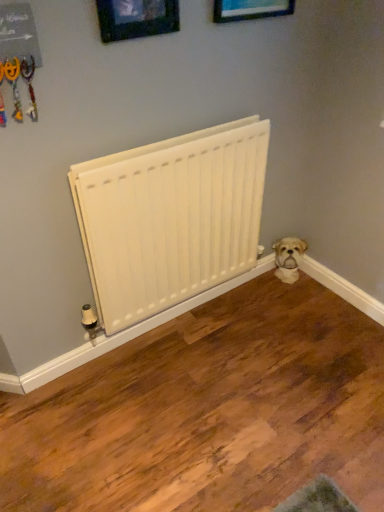
Question: Considering the relative sizes of white fluffy dog at lower right and wooden picture frame at upper center, which is the 1th picture frame from right to left, in the image provided, is white fluffy dog at lower right wider than wooden picture frame at upper center, which is the 1th picture frame from right to left,?

Choices:
 (A) yes
 (B) no

Answer: (A)

Question: Can you confirm if white fluffy dog at lower right is shorter than wooden picture frame at upper center, which is the 1th picture frame from right to left?

Choices:
 (A) no
 (B) yes

Answer: (B)

Question: Does white fluffy dog at lower right contain wooden picture frame at upper center, which is the 1th picture frame from right to left?

Choices:
 (A) no
 (B) yes

Answer: (A)

Question: Is white fluffy dog at lower right thinner than wooden picture frame at upper center, which is the 1th picture frame from right to left?

Choices:
 (A) yes
 (B) no

Answer: (B)

Question: Is white fluffy dog at lower right not close to wooden picture frame at upper center, arranged as the 2th picture frame when viewed from the left?

Choices:
 (A) yes
 (B) no

Answer: (A)

Question: From the image's perspective, is white fluffy dog at lower right over wooden picture frame at upper center, which is the 1th picture frame from right to left?

Choices:
 (A) yes
 (B) no

Answer: (B)

Question: Is white matte radiator at center bigger than white fluffy dog at lower right?

Choices:
 (A) no
 (B) yes

Answer: (B)

Question: Does white matte radiator at center have a greater height compared to white fluffy dog at lower right?

Choices:
 (A) yes
 (B) no

Answer: (A)

Question: Is white matte radiator at center touching white fluffy dog at lower right?

Choices:
 (A) no
 (B) yes

Answer: (A)

Question: Is white matte radiator at center smaller than white fluffy dog at lower right?

Choices:
 (A) no
 (B) yes

Answer: (A)

Question: Is the depth of white matte radiator at center less than that of white fluffy dog at lower right?

Choices:
 (A) yes
 (B) no

Answer: (A)

Question: Can you confirm if white matte radiator at center is wider than white fluffy dog at lower right?

Choices:
 (A) yes
 (B) no

Answer: (B)

Question: From a real-world perspective, does wooden picture frame at upper center, which appears as the 2th picture frame when viewed from the right, sit lower than wooden picture frame at upper center, which is the 1th picture frame from right to left?

Choices:
 (A) no
 (B) yes

Answer: (B)